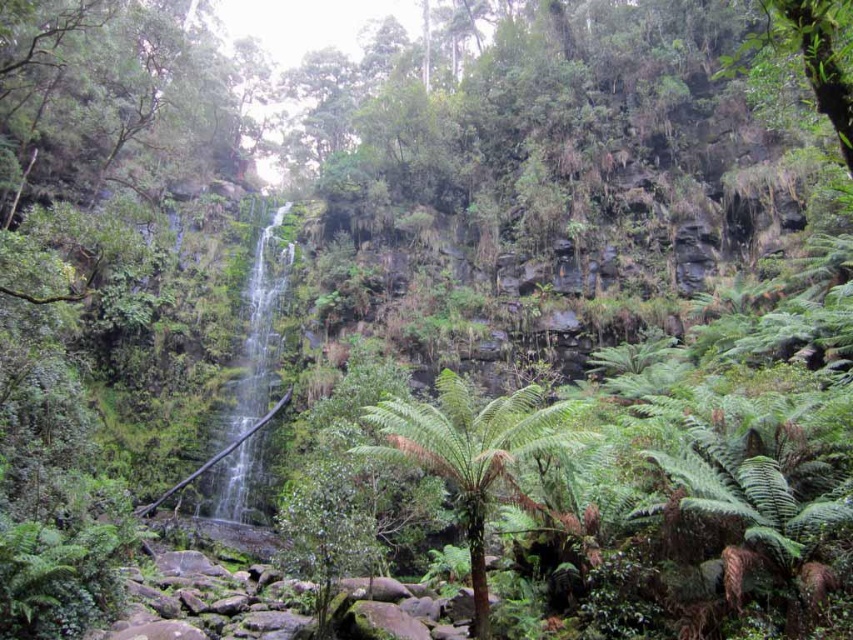
Can you confirm if green leafy fern at center is taller than green mossy waterfall at center?

No, green leafy fern at center is not taller than green mossy waterfall at center.

Based on the photo, between green leafy fern at center and green mossy waterfall at center, which one has more height?

green mossy waterfall at center

Between point (503, 408) and point (279, 273), which one is positioned behind?

Positioned behind is point (279, 273).

Locate an element on the screen. This screenshot has width=853, height=640. green leafy fern at center is located at coordinates pyautogui.click(x=471, y=451).